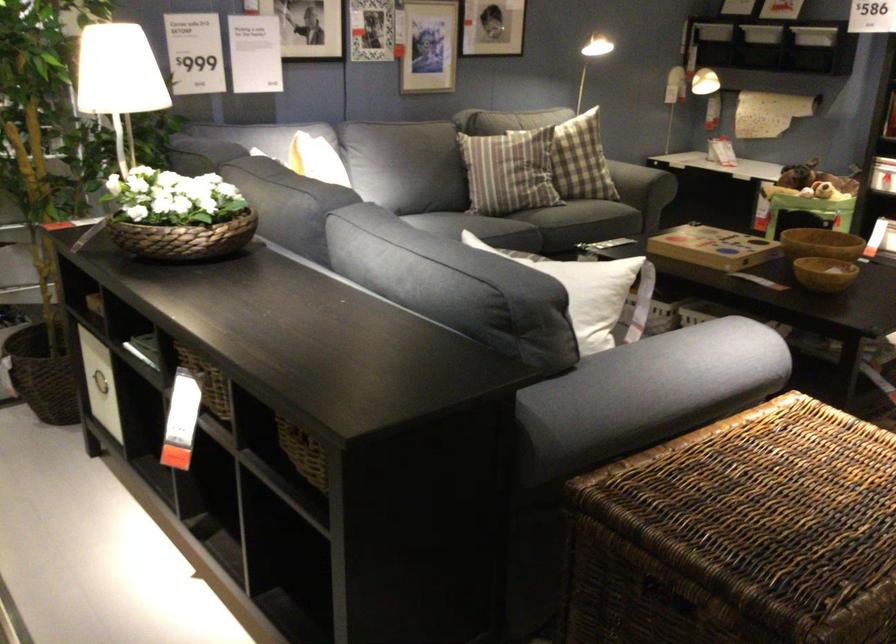
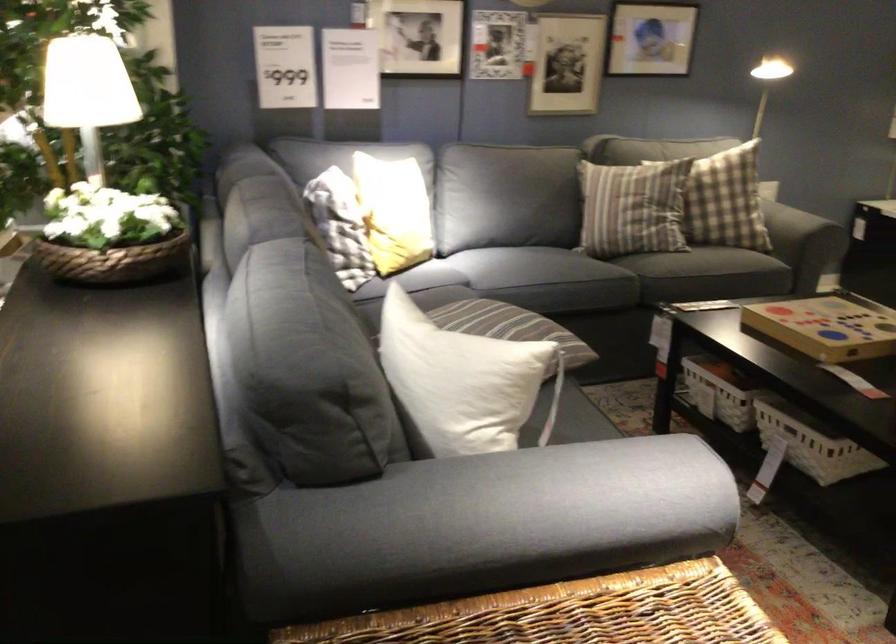
Where in the second image is the point corresponding to [574,299] from the first image?

(462, 381)